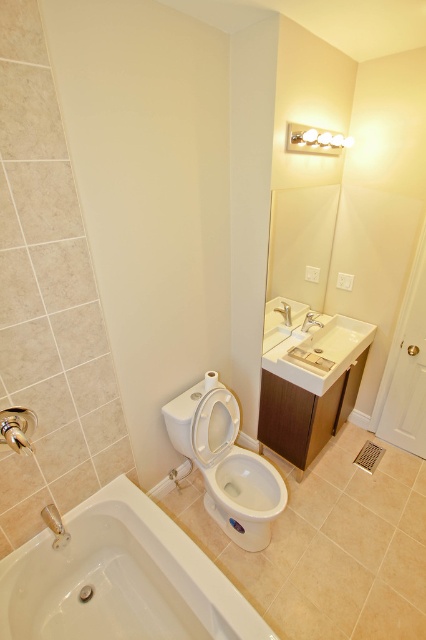
Between point (331, 145) and point (322, 326), which one is positioned behind?

Point (322, 326)

At what (x,y) coordinates should I click in order to perform the action: click on white glossy light fixture at upper center. Please return your answer as a coordinate pair (x, y). This screenshot has width=426, height=640. Looking at the image, I should click on (316, 138).

Locate an element on the screen. This screenshot has width=426, height=640. white glossy light fixture at upper center is located at coordinates (316, 138).

Who is higher up, white glossy bathtub at lower left or white glossy toilet bowl at lower center?

white glossy toilet bowl at lower center

How much distance is there between white glossy bathtub at lower left and white glossy toilet bowl at lower center?

They are 18.78 inches apart.

Describe the element at coordinates (120, 579) in the screenshot. I see `white glossy bathtub at lower left` at that location.

Locate an element on the screen. The width and height of the screenshot is (426, 640). white glossy bathtub at lower left is located at coordinates tap(120, 579).

Between white glossy bathtub at lower left and white glossy toilet bowl at center, which one has less height?

white glossy toilet bowl at center is shorter.

Does white glossy bathtub at lower left have a greater height compared to white glossy toilet bowl at center?

Indeed, white glossy bathtub at lower left has a greater height compared to white glossy toilet bowl at center.

Is point (114, 493) positioned after point (253, 532)?

No, it is not.

Locate an element on the screen. The width and height of the screenshot is (426, 640). white glossy bathtub at lower left is located at coordinates (120, 579).